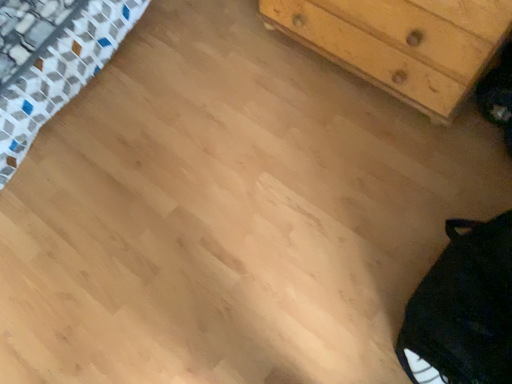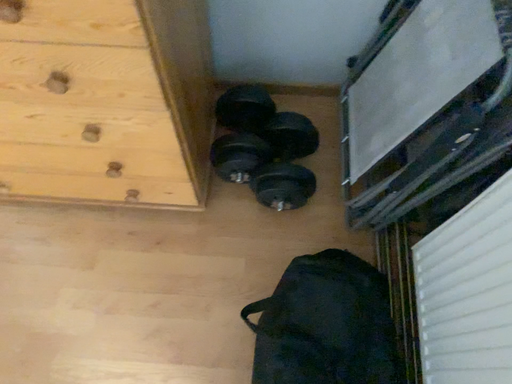
Question: Which way did the camera rotate in the video?

Choices:
 (A) rotated downward
 (B) rotated upward

Answer: (B)